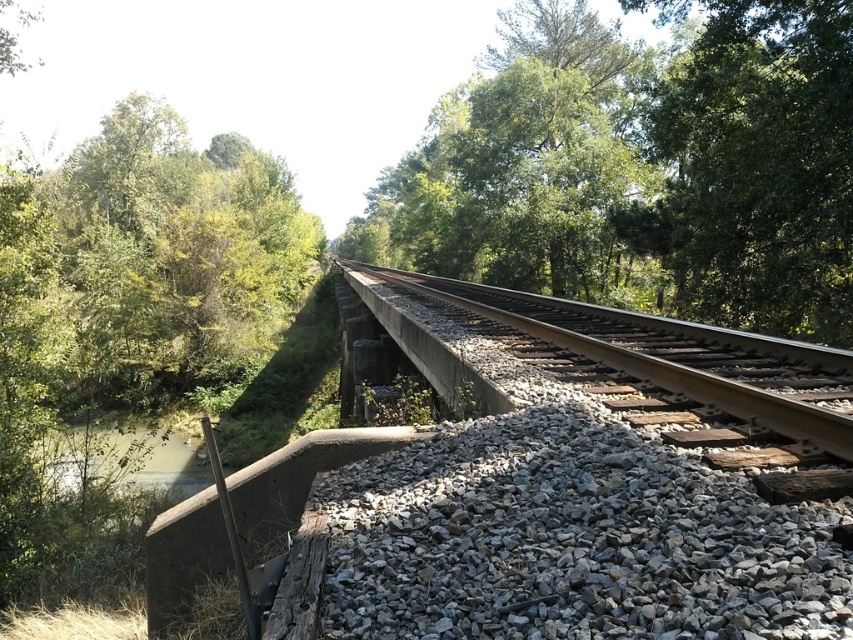
Question: Estimate the real-world distances between objects in this image. Which object is closer to the green leafy tree at center?

Choices:
 (A) muddy water at lower left
 (B) gray gravel at center
 (C) smooth concrete track at center

Answer: (C)

Question: Which of the following is the farthest from the observer?

Choices:
 (A) green leafy tree at center
 (B) gray gravel at center
 (C) smooth concrete track at center
 (D) muddy water at lower left

Answer: (D)

Question: Which object is positioned closest to the green leafy tree at center?

Choices:
 (A) smooth concrete track at center
 (B) gray gravel at center
 (C) muddy water at lower left
 (D) green leafy tree at upper right

Answer: (D)

Question: Does gray gravel at center appear under green leafy tree at upper right?

Choices:
 (A) no
 (B) yes

Answer: (B)

Question: Does green leafy tree at center have a smaller size compared to muddy water at lower left?

Choices:
 (A) no
 (B) yes

Answer: (A)

Question: Is green leafy tree at center in front of smooth concrete track at center?

Choices:
 (A) no
 (B) yes

Answer: (A)